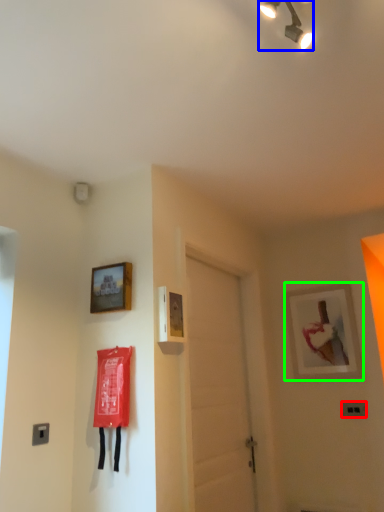
Question: Which object is the closest to the light switch (highlighted by a red box)? Choose among these: lamp (highlighted by a blue box) or picture frame (highlighted by a green box).

Choices:
 (A) lamp
 (B) picture frame

Answer: (B)